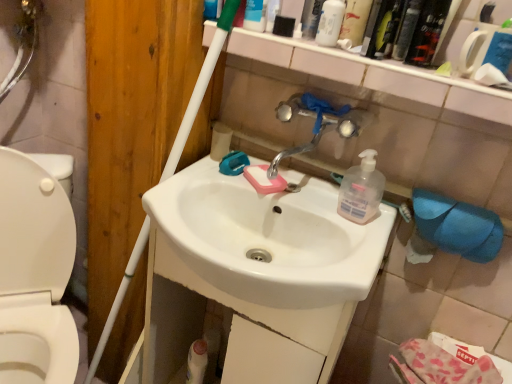
Question: Is white matte bottle at upper center, which is counted as the 1th cleaning product, starting from the top, next to metallic silver faucet at upper center and touching it?

Choices:
 (A) yes
 (B) no

Answer: (B)

Question: Does white matte bottle at upper center, which is counted as the 1th cleaning product, starting from the top, have a greater height compared to metallic silver faucet at upper center?

Choices:
 (A) no
 (B) yes

Answer: (B)

Question: Is white matte bottle at upper center, which is counted as the 1th cleaning product, starting from the top, bigger than metallic silver faucet at upper center?

Choices:
 (A) yes
 (B) no

Answer: (B)

Question: Is white matte bottle at upper center, the 2th cleaning product positioned from the bottom, to the left of metallic silver faucet at upper center from the viewer's perspective?

Choices:
 (A) yes
 (B) no

Answer: (A)

Question: Does white matte bottle at upper center, the 2th cleaning product positioned from the bottom, have a lesser width compared to metallic silver faucet at upper center?

Choices:
 (A) yes
 (B) no

Answer: (A)

Question: Is metallic silver canister at upper center, which is counted as the 2th toiletry, starting from the left, inside or outside of metallic silver faucet at upper center?

Choices:
 (A) outside
 (B) inside

Answer: (A)

Question: Considering the positions of metallic silver canister at upper center, the 1th toiletry viewed from the right, and metallic silver faucet at upper center in the image, is metallic silver canister at upper center, the 1th toiletry viewed from the right, taller or shorter than metallic silver faucet at upper center?

Choices:
 (A) short
 (B) tall

Answer: (B)

Question: Considering the positions of point (321, 3) and point (350, 81), is point (321, 3) closer or farther from the camera than point (350, 81)?

Choices:
 (A) closer
 (B) farther

Answer: (B)

Question: From a real-world perspective, is metallic silver canister at upper center, the 1th toiletry viewed from the right, physically located above or below metallic silver faucet at upper center?

Choices:
 (A) above
 (B) below

Answer: (A)

Question: Is point (413, 24) positioned closer to the camera than point (23, 349)?

Choices:
 (A) farther
 (B) closer

Answer: (B)

Question: From the image's perspective, relative to white glossy toilet at left, is green plastic bottle at upper right, placed as the second mouthwash when sorted from right to left, above or below?

Choices:
 (A) below
 (B) above

Answer: (B)

Question: Considering their positions, is green plastic bottle at upper right, acting as the second mouthwash starting from the left, located in front of or behind white glossy toilet at left?

Choices:
 (A) behind
 (B) front

Answer: (A)

Question: Based on their positions, is green plastic bottle at upper right, placed as the second mouthwash when sorted from right to left, located to the left or right of white glossy toilet at left?

Choices:
 (A) left
 (B) right

Answer: (B)

Question: Considering their positions, is white matte bottle at upper center, the 2th cleaning product positioned from the bottom, located in front of or behind black plastic mouthwash at upper right, the third mouthwash from the left?

Choices:
 (A) behind
 (B) front

Answer: (A)

Question: From the image's perspective, is white matte bottle at upper center, which is counted as the 1th cleaning product, starting from the top, positioned above or below black plastic mouthwash at upper right, the first mouthwash from the right?

Choices:
 (A) above
 (B) below

Answer: (A)